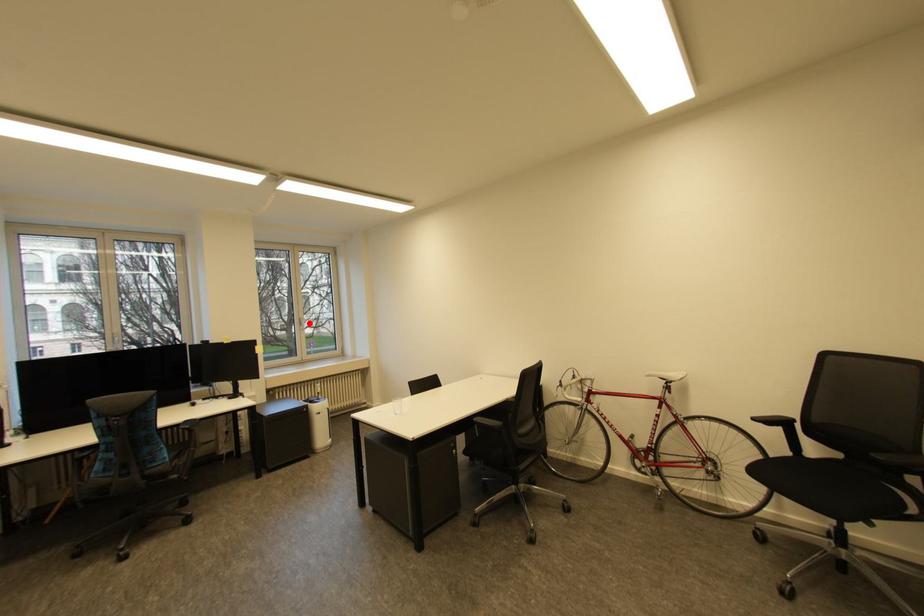
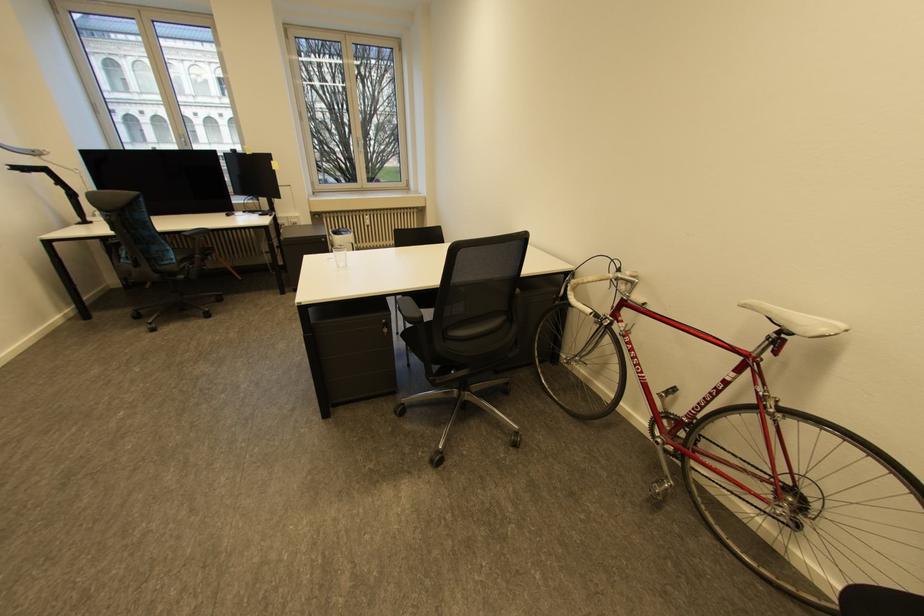
Locate, in the second image, the point that corresponds to the highlighted location in the first image.

(367, 143)